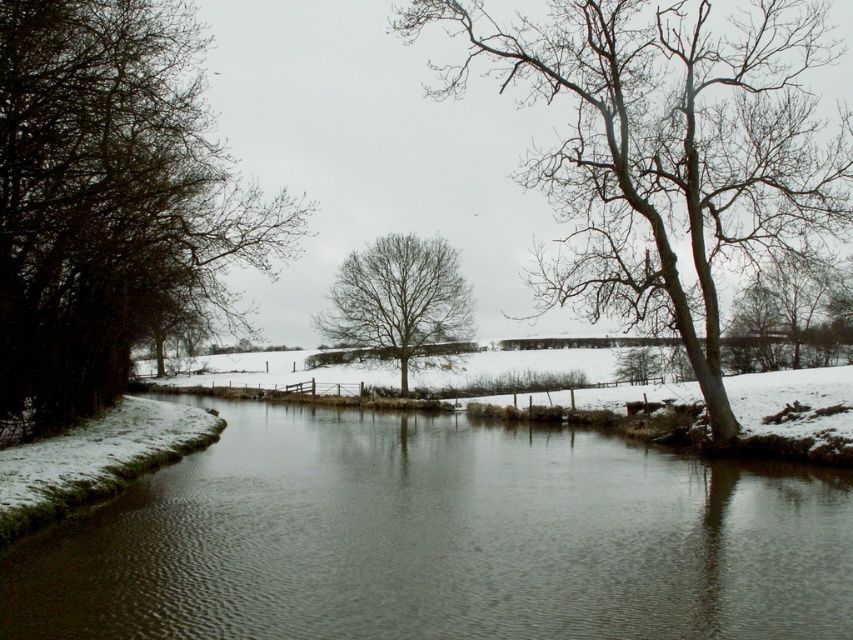
You are standing at the center of the riverbank and looking towards the trees. Which tree, the bare wood tree at right or the bare wood tree at upper right, is closer to you?

The bare wood tree at right is closer to you because it is in front of the bare wood tree at upper right.